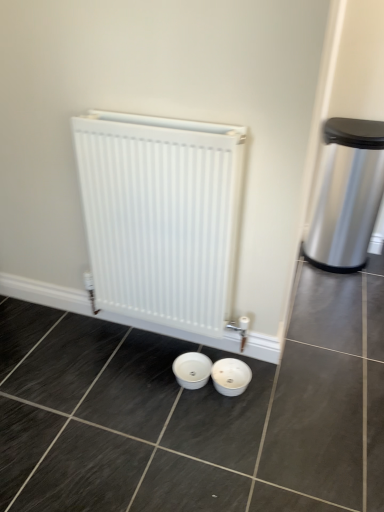
Where is `free space in front of white glossy basin at center`? The height and width of the screenshot is (512, 384). free space in front of white glossy basin at center is located at coordinates (241, 426).